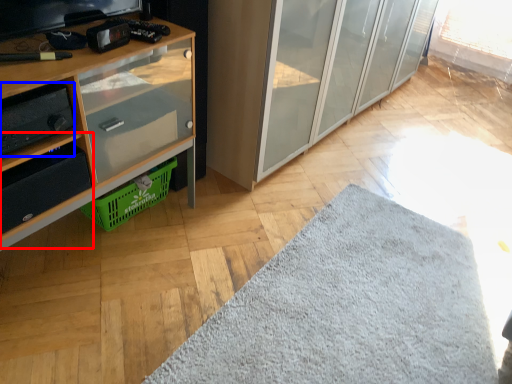
Question: Which object appears farthest to the camera in this image, shelf (highlighted by a red box) or stereo (highlighted by a blue box)?

Choices:
 (A) shelf
 (B) stereo

Answer: (A)